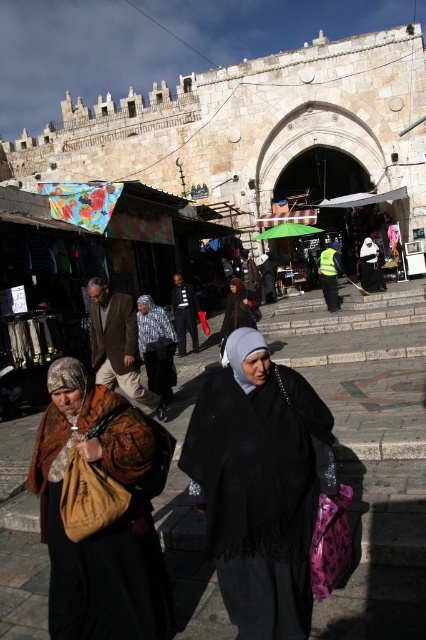
Question: Does brown textured fabric bag at lower left appear under dark gray knit hat at center?

Choices:
 (A) yes
 (B) no

Answer: (A)

Question: Can you confirm if black woolen shawl at center is smaller than dark gray knit hat at center?

Choices:
 (A) no
 (B) yes

Answer: (A)

Question: Among these points, which one is farthest from the camera?

Choices:
 (A) (242, 321)
 (B) (120, 429)

Answer: (A)

Question: Estimate the real-world distances between objects in this image. Which object is farther from the brown textured fabric bag at lower left?

Choices:
 (A) dark gray knit hat at center
 (B) black woolen shawl at center

Answer: (A)

Question: Estimate the real-world distances between objects in this image. Which object is farther from the black woolen shawl at center?

Choices:
 (A) dark gray knit hat at center
 (B) brown textured fabric bag at lower left

Answer: (A)

Question: Where is black woolen shawl at center located in relation to brown textured fabric bag at lower left in the image?

Choices:
 (A) below
 (B) above

Answer: (B)